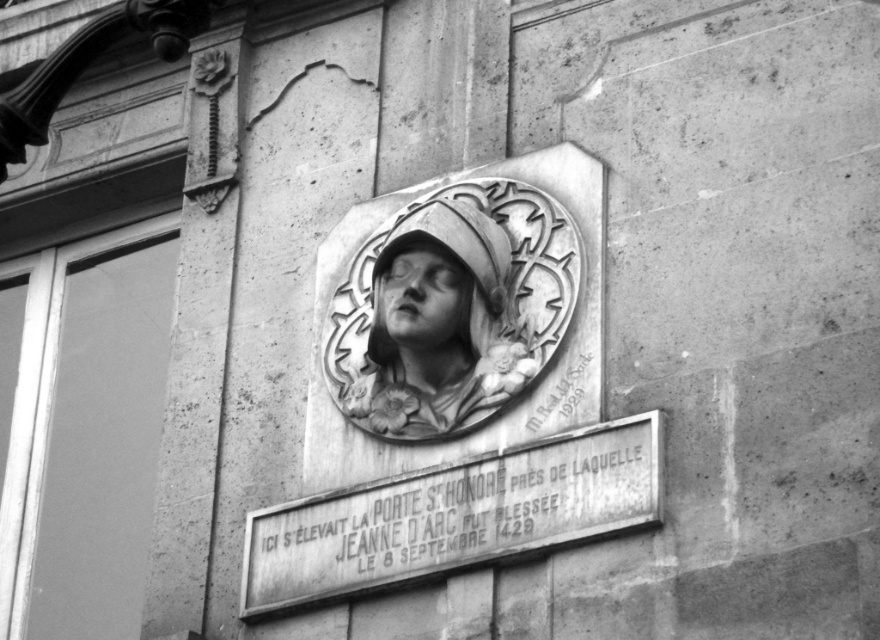
What is the significance of the point marked at coordinates [438,326] on the historical plaque?

The point marked at coordinates [438,326] indicates the location of the white marble bust at the center of the plaque, which commemorates where Jeanne dArc was wounded.

You are a tourist standing in front of the historical plaque. You notice the white marble bust at center and the matte stone face at center. Which object is closer to you?

The white marble bust at center is closer to you because it is further to the viewer than the matte stone face at center.

You are a tour guide explaining the historical site to visitors. You point to the white stone plaque at center and the white marble bust at center. Which object is larger in size?

The white stone plaque at center is larger than the white marble bust at center.